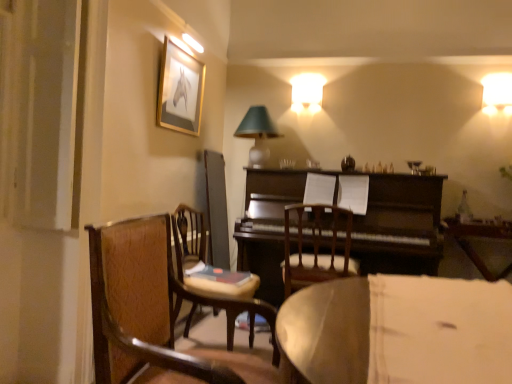
Question: Is gold-framed picture at upper left in front of wooden chair at center, which is the first chair from back to front?

Choices:
 (A) no
 (B) yes

Answer: (A)

Question: Is gold-framed picture at upper left outside wooden chair at center, which is the first chair from back to front?

Choices:
 (A) no
 (B) yes

Answer: (B)

Question: Is gold-framed picture at upper left wider than wooden chair at center, marked as the 3th chair in a front-to-back arrangement?

Choices:
 (A) no
 (B) yes

Answer: (A)

Question: Are gold-framed picture at upper left and wooden chair at center, which is the first chair from back to front, beside each other?

Choices:
 (A) no
 (B) yes

Answer: (A)

Question: From the image's perspective, is gold-framed picture at upper left on top of wooden chair at center, which is the first chair from back to front?

Choices:
 (A) no
 (B) yes

Answer: (B)

Question: Does gold-framed picture at upper left lie behind wooden chair at center, marked as the 3th chair in a front-to-back arrangement?

Choices:
 (A) no
 (B) yes

Answer: (B)

Question: Could you tell me if wooden chair at left, the third chair when ordered from back to front, is turned towards dark brown polished wood piano at center?

Choices:
 (A) yes
 (B) no

Answer: (B)

Question: Could dark brown polished wood piano at center be considered to be inside wooden chair at left, the third chair when ordered from back to front?

Choices:
 (A) no
 (B) yes

Answer: (A)

Question: Does wooden chair at left, which is counted as the 1th chair, starting from the front, come behind dark brown polished wood piano at center?

Choices:
 (A) no
 (B) yes

Answer: (A)

Question: Does wooden chair at left, the third chair when ordered from back to front, have a lesser height compared to dark brown polished wood piano at center?

Choices:
 (A) yes
 (B) no

Answer: (A)

Question: Is wooden chair at left, the third chair when ordered from back to front, to the left of dark brown polished wood piano at center from the viewer's perspective?

Choices:
 (A) yes
 (B) no

Answer: (A)

Question: Can you see wooden chair at left, the third chair when ordered from back to front, touching dark brown polished wood piano at center?

Choices:
 (A) yes
 (B) no

Answer: (B)

Question: Is wooden chair at center, which is the second chair from back to front, to the right of matte glass table lamp at upper center from the viewer's perspective?

Choices:
 (A) yes
 (B) no

Answer: (B)